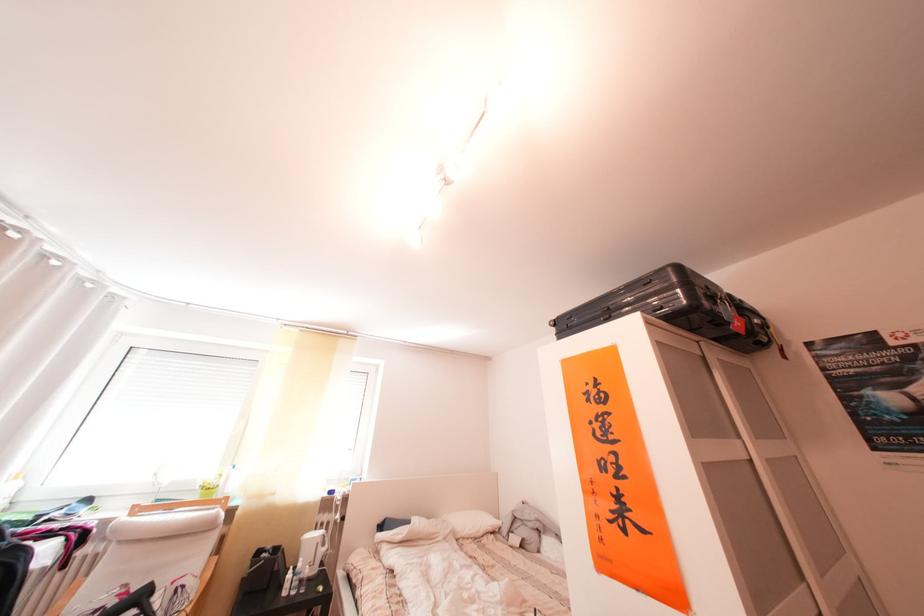
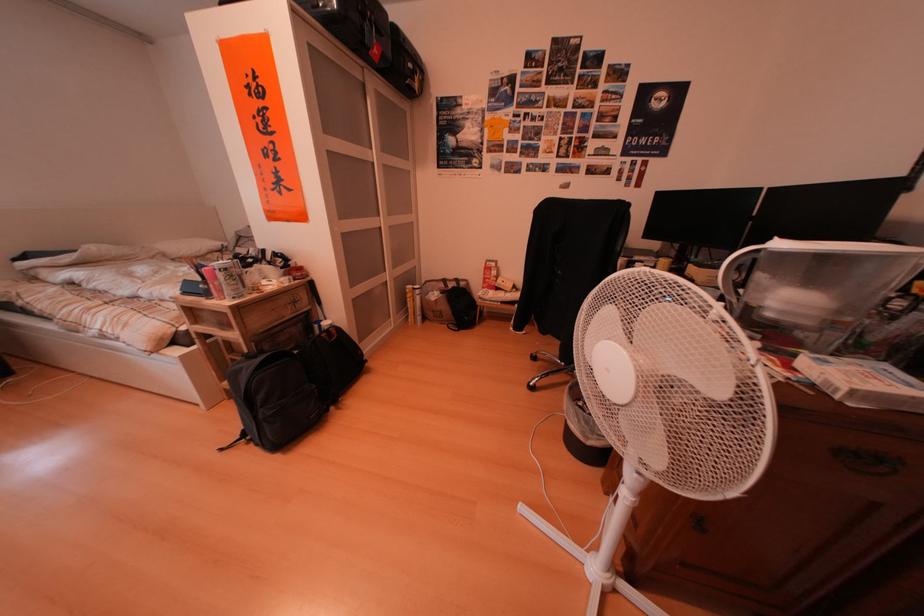
First-person continuous shooting, in which direction is the camera rotating?

The camera rotated toward right-down.